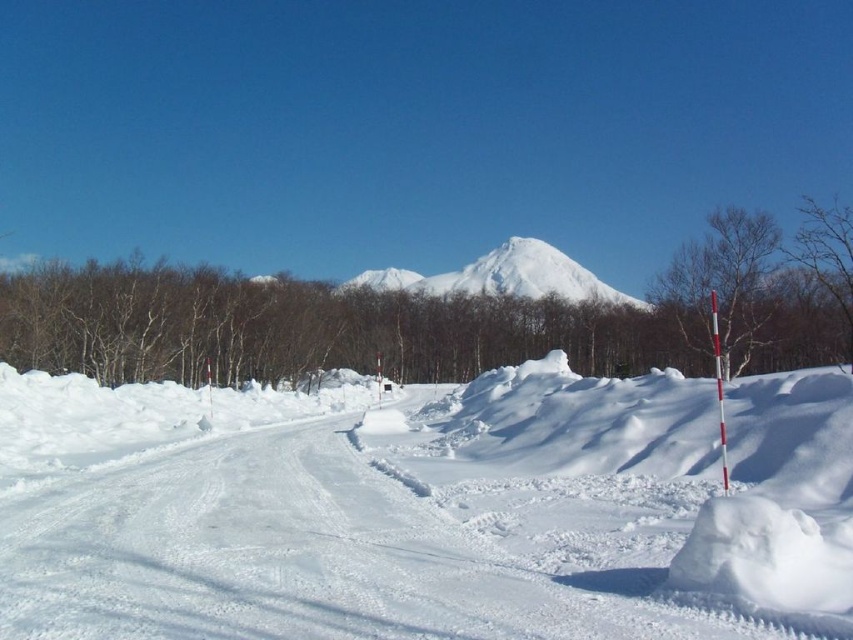
You are standing at the point marked by the red and white striped pole on the right side of the road in the winter scene. Looking towards the center of the image, what color is the ground at the point indicated by the coordinates (426, 509)?

The point at coordinates (426, 509) is on white snow at center, so the ground there is white.

You are a hiker planning to walk from the white snow at center to the bare branches at upper right. The path is straight. Your GPS says the distance is 160.45 meters. Is this distance accurate based on the image?

The white snow at center is 160.45 meters from the bare branches at upper right, so the GPS distance is accurate.

You are standing at the snow covered road and want to reach the point with coordinates point [38,404] and point [706,276]. Which point is closer to you?

Point [38,404] is closer to the viewer than point [706,276].